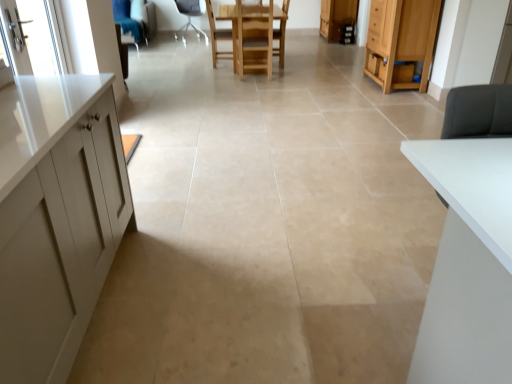
Question: From the image's perspective, would you say wooden cabinet at upper right, the 2th cabinetry positioned from the front, is shown under clear glass screen door at upper left?

Choices:
 (A) yes
 (B) no

Answer: (B)

Question: Can you confirm if wooden cabinet at upper right, acting as the first cabinetry starting from the back, is smaller than clear glass screen door at upper left?

Choices:
 (A) yes
 (B) no

Answer: (B)

Question: Can you confirm if wooden cabinet at upper right, the 2th cabinetry positioned from the front, is bigger than clear glass screen door at upper left?

Choices:
 (A) no
 (B) yes

Answer: (B)

Question: Is wooden cabinet at upper right, positioned as the second cabinetry in bottom-to-top order, wider than clear glass screen door at upper left?

Choices:
 (A) no
 (B) yes

Answer: (B)

Question: Is wooden cabinet at upper right, the 2th cabinetry positioned from the front, thinner than clear glass screen door at upper left?

Choices:
 (A) yes
 (B) no

Answer: (B)

Question: Considering the positions of wooden cabinet at upper right, the 2th cabinetry positioned from the front, and white fabric chair at center, placed as the 3th chair when sorted from front to back, in the image, is wooden cabinet at upper right, the 2th cabinetry positioned from the front, taller or shorter than white fabric chair at center, placed as the 3th chair when sorted from front to back,?

Choices:
 (A) short
 (B) tall

Answer: (A)

Question: Considering the relative positions of wooden cabinet at upper right, acting as the first cabinetry starting from the back, and white fabric chair at center, placed as the 3th chair when sorted from front to back, in the image provided, is wooden cabinet at upper right, acting as the first cabinetry starting from the back, to the left or to the right of white fabric chair at center, placed as the 3th chair when sorted from front to back,?

Choices:
 (A) left
 (B) right

Answer: (B)

Question: From the image's perspective, relative to white fabric chair at center, the first chair from the back, is wooden cabinet at upper right, acting as the 1th cabinetry starting from the top, above or below?

Choices:
 (A) below
 (B) above

Answer: (B)

Question: Does point (333, 6) appear closer or farther from the camera than point (181, 13)?

Choices:
 (A) farther
 (B) closer

Answer: (B)

Question: Is clear glass screen door at upper left in front of or behind wooden chair at center in the image?

Choices:
 (A) behind
 (B) front

Answer: (B)

Question: In the image, is clear glass screen door at upper left on the left side or the right side of wooden chair at center?

Choices:
 (A) left
 (B) right

Answer: (A)

Question: Considering the positions of clear glass screen door at upper left and wooden chair at center in the image, is clear glass screen door at upper left bigger or smaller than wooden chair at center?

Choices:
 (A) big
 (B) small

Answer: (B)

Question: Does point (50, 13) appear closer or farther from the camera than point (285, 16)?

Choices:
 (A) closer
 (B) farther

Answer: (A)

Question: Visually, is wooden chair at center, which ranks as the 2th chair in right-to-left order, positioned to the left or to the right of wooden cabinet at upper right, acting as the 1th cabinetry starting from the top?

Choices:
 (A) left
 (B) right

Answer: (A)

Question: Looking at their shapes, would you say wooden chair at center, which appears as the second chair when viewed from the front, is wider or thinner than wooden cabinet at upper right, the 2th cabinetry positioned from the front?

Choices:
 (A) thin
 (B) wide

Answer: (A)